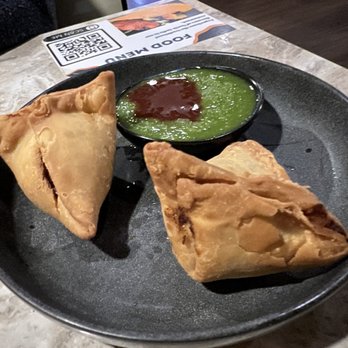
At what (x,y) coordinates should I click in order to perform the action: click on placemat upper left of plate. Please return your answer as a coordinate pair (x, y). The height and width of the screenshot is (348, 348). Looking at the image, I should click on (18, 80).